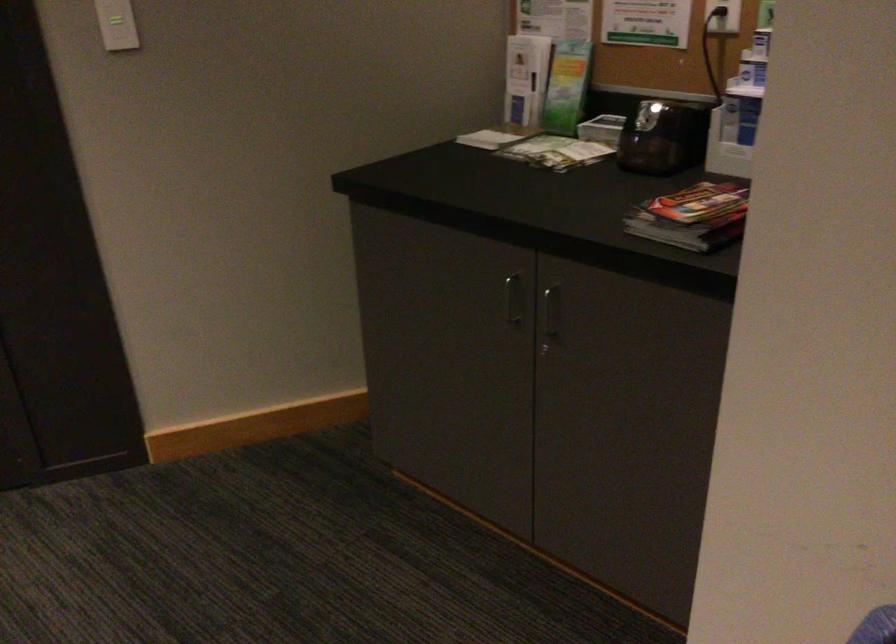
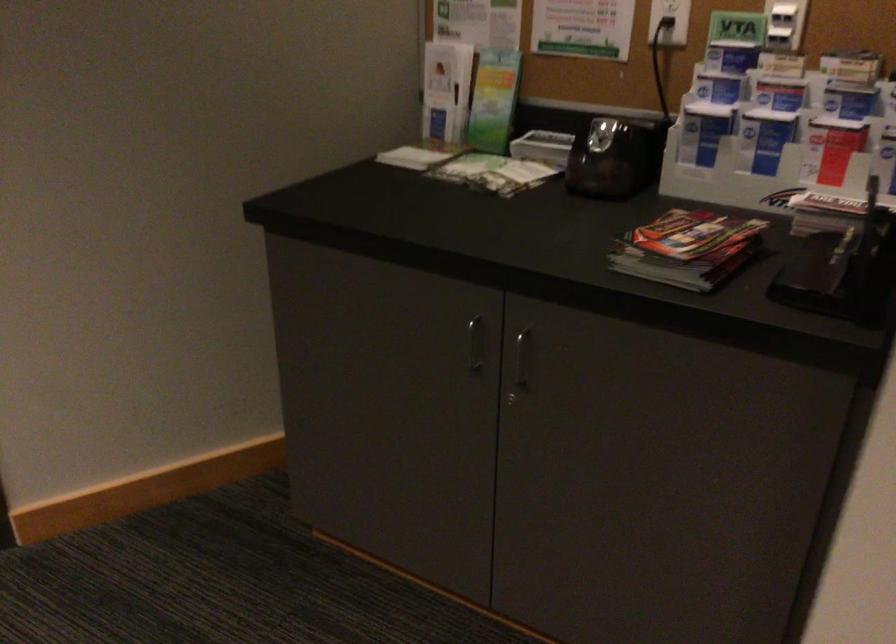
Locate, in the second image, the point that corresponds to (513,299) in the first image.

(475, 343)